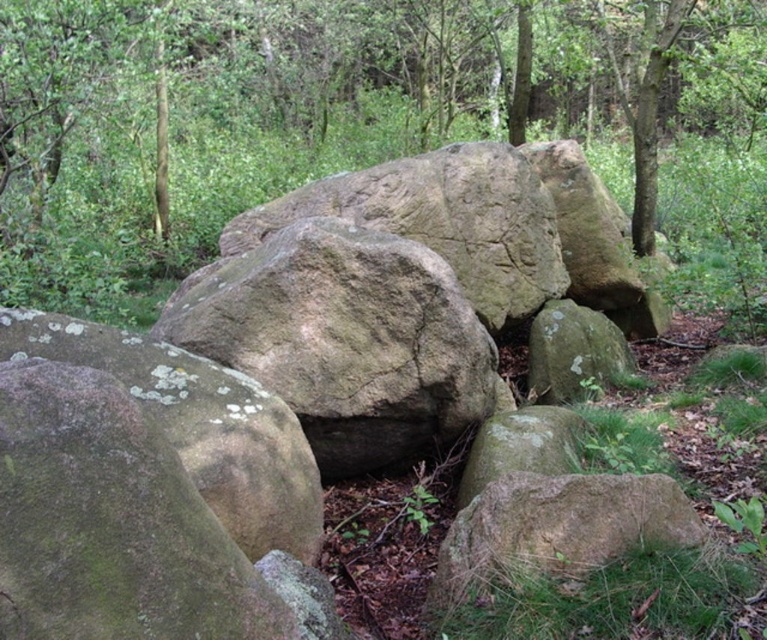
Describe the element at coordinates (420, 285) in the screenshot. I see `smooth beige rock at center` at that location.

Is point (558, 227) behind point (459, 598)?

That is True.

Identify the location of smooth beige rock at center. (420, 285).

Does green mossy rock at center have a lesser height compared to green mossy rock at lower center?

No.

Between green mossy rock at center and green mossy rock at lower center, which one is positioned higher?

green mossy rock at center is above.

Does point (552, 364) come farther from viewer compared to point (540, 438)?

Yes, point (552, 364) is behind point (540, 438).

The image size is (767, 640). What are the coordinates of `green mossy rock at center` in the screenshot? It's located at (573, 353).

Consider the image. Is green mossy rock at lower left further to the viewer compared to green mossy rock at lower right?

Yes, green mossy rock at lower left is behind green mossy rock at lower right.

Does green mossy rock at lower left have a smaller size compared to green mossy rock at lower right?

No.

You are a GUI agent. You are given a task and a screenshot of the screen. Output one action in this format:
    pyautogui.click(x=<x>, y=<y>)
    Task: Click on the green mossy rock at lower left
    The height and width of the screenshot is (640, 767).
    Given the screenshot: What is the action you would take?
    pyautogui.click(x=199, y=426)